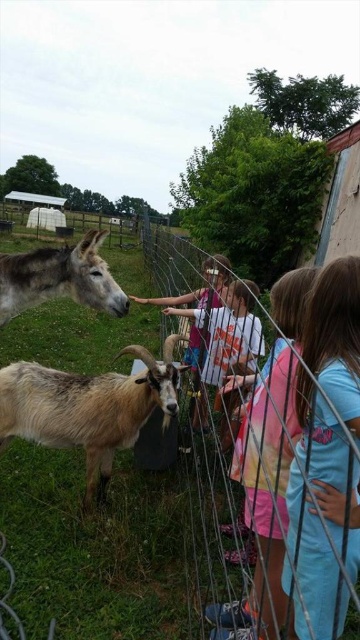
Question: Does light blue cotton shirt at center come in front of brown fuzzy goat at lower left?

Choices:
 (A) no
 (B) yes

Answer: (B)

Question: Which object appears closest to the camera in this image?

Choices:
 (A) light blue cotton shirt at center
 (B) blue cotton shirt at right
 (C) wire mesh fence at center
 (D) gray matte donkey at left

Answer: (B)

Question: Can you confirm if brown fuzzy goat at lower left is thinner than gray matte donkey at left?

Choices:
 (A) yes
 (B) no

Answer: (B)

Question: Which object is the closest to the gray matte donkey at left?

Choices:
 (A) blue cotton shirt at right
 (B) brown fuzzy goat at lower left

Answer: (B)

Question: Which object appears farthest from the camera in this image?

Choices:
 (A) blue cotton shirt at right
 (B) wire mesh fence at center

Answer: (B)

Question: Considering the relative positions of wire mesh fence at center and light blue cotton shirt at center in the image provided, where is wire mesh fence at center located with respect to light blue cotton shirt at center?

Choices:
 (A) above
 (B) below

Answer: (B)